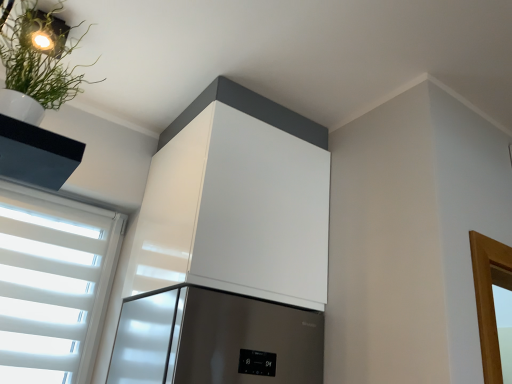
Question: Are green matte plant at upper left and white glossy cabinet at upper center far apart?

Choices:
 (A) yes
 (B) no

Answer: (B)

Question: From the image's perspective, does green matte plant at upper left appear lower than white glossy cabinet at upper center?

Choices:
 (A) yes
 (B) no

Answer: (B)

Question: Could white glossy cabinet at upper center be considered to be inside green matte plant at upper left?

Choices:
 (A) yes
 (B) no

Answer: (B)

Question: Considering the relative sizes of green matte plant at upper left and white glossy cabinet at upper center in the image provided, is green matte plant at upper left shorter than white glossy cabinet at upper center?

Choices:
 (A) yes
 (B) no

Answer: (A)

Question: From the image's perspective, is green matte plant at upper left located above white glossy cabinet at upper center?

Choices:
 (A) yes
 (B) no

Answer: (A)

Question: Does green matte plant at upper left have a smaller size compared to white glossy cabinet at upper center?

Choices:
 (A) no
 (B) yes

Answer: (B)

Question: Is white glossy cabinet at upper center in front of green matte plant at upper left?

Choices:
 (A) no
 (B) yes

Answer: (A)

Question: Would you say white glossy cabinet at upper center is a long distance from green matte plant at upper left?

Choices:
 (A) no
 (B) yes

Answer: (A)

Question: Is white glossy cabinet at upper center aimed at green matte plant at upper left?

Choices:
 (A) no
 (B) yes

Answer: (A)

Question: Is white glossy cabinet at upper center located outside green matte plant at upper left?

Choices:
 (A) no
 (B) yes

Answer: (B)

Question: Does white glossy cabinet at upper center touch green matte plant at upper left?

Choices:
 (A) yes
 (B) no

Answer: (B)

Question: Can you confirm if white glossy cabinet at upper center is smaller than green matte plant at upper left?

Choices:
 (A) no
 (B) yes

Answer: (A)

Question: Considering the positions of white glossy cabinet at upper center and green matte plant at upper left in the image, is white glossy cabinet at upper center wider or thinner than green matte plant at upper left?

Choices:
 (A) wide
 (B) thin

Answer: (A)